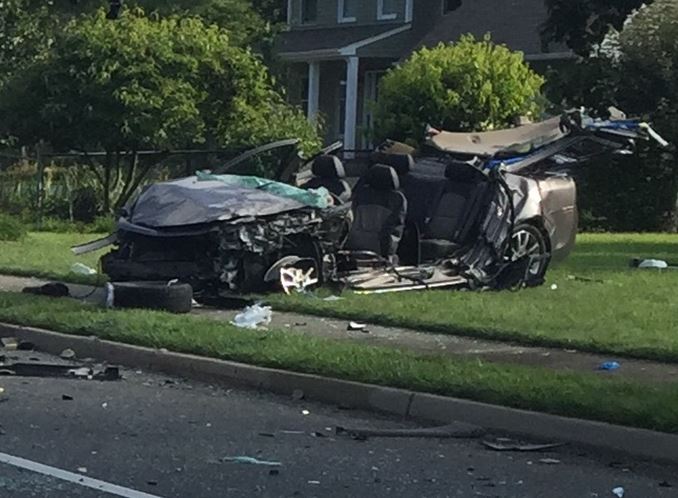
At what (x,y) coordinates should I click in order to perform the action: click on pillar. Please return your answer as a coordinate pair (x, y). This screenshot has width=678, height=498. Looking at the image, I should click on (344, 104), (316, 124).